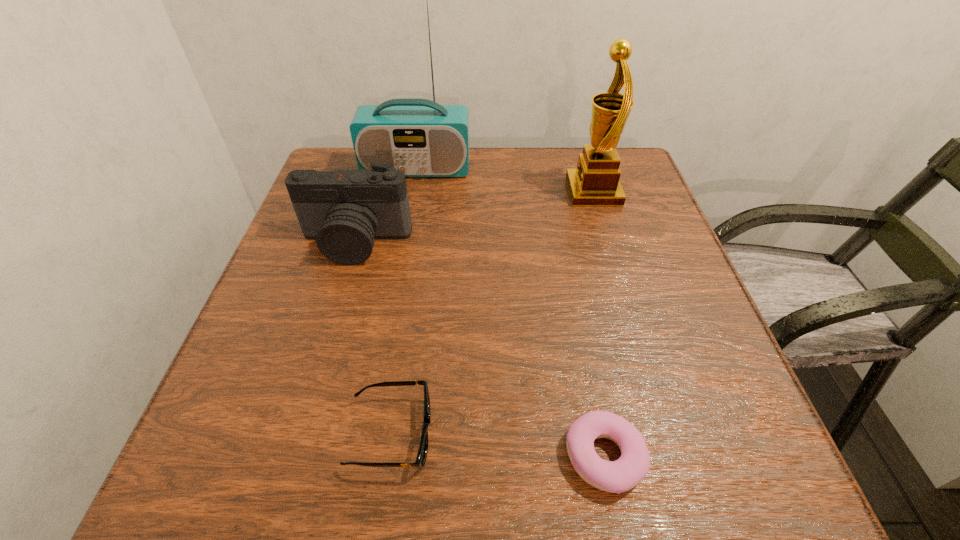
Find the location of a particular element. unoccupied area between the second tallest object and the radio receiver is located at coordinates [x=505, y=180].

Find the location of a particular element. This screenshot has width=960, height=540. unoccupied position between the fourth shortest object and the sunglasses is located at coordinates (492, 313).

Image resolution: width=960 pixels, height=540 pixels. I want to click on empty space that is in between the pastry and the second tallest object, so click(x=599, y=324).

This screenshot has width=960, height=540. I want to click on free spot between the tallest object and the sunglasses, so click(404, 301).

This screenshot has height=540, width=960. I want to click on free spot between the pastry and the sunglasses, so click(497, 445).

Locate which object ranks in proximity to the sunglasses. Please provide its 2D coordinates. Your answer should be formatted as a tuple, i.e. [(x, y)], where the tuple contains the x and y coordinates of a point satisfying the conditions above.

[(618, 476)]

Locate an element on the screen. The width and height of the screenshot is (960, 540). object that stands as the fourth closest to the third shortest object is located at coordinates (618, 476).

Locate an element on the screen. free point that satisfies the following two spatial constraints: 1. on the front panel of the pastry; 2. on the right side of the tallest object is located at coordinates (364, 457).

Locate an element on the screen. The height and width of the screenshot is (540, 960). vacant area that satisfies the following two spatial constraints: 1. on the back side of the pastry; 2. on the front-facing side of the sunglasses is located at coordinates (600, 434).

You are a GUI agent. You are given a task and a screenshot of the screen. Output one action in this format:
    pyautogui.click(x=<x>, y=<y>)
    Task: Click on the vacant area in the image that satisfies the following two spatial constraints: 1. on the back side of the pastry; 2. on the front-facing side of the sunglasses
    The width and height of the screenshot is (960, 540).
    Given the screenshot: What is the action you would take?
    pos(600,434)